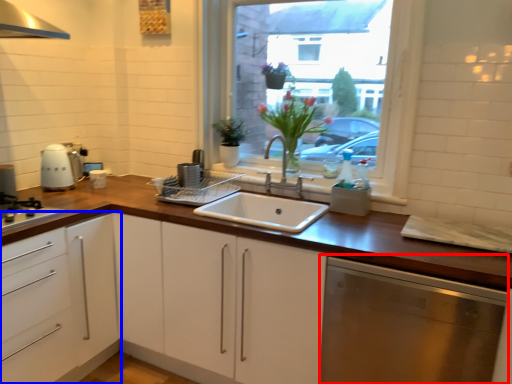
Question: Among these objects, which one is nearest to the camera, dish washer (highlighted by a red box) or cabinetry (highlighted by a blue box)?

Choices:
 (A) dish washer
 (B) cabinetry

Answer: (A)